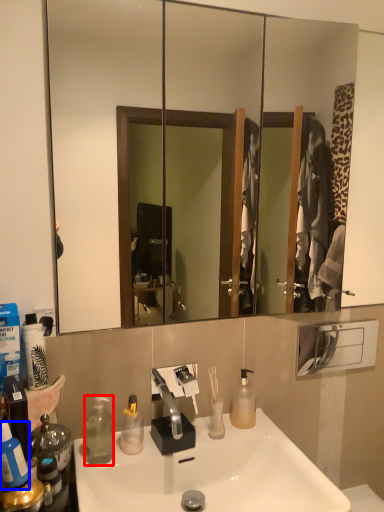
Question: Which object appears closest to the camera in this image, bottle (highlighted by a red box) or bottle (highlighted by a blue box)?

Choices:
 (A) bottle
 (B) bottle

Answer: (B)